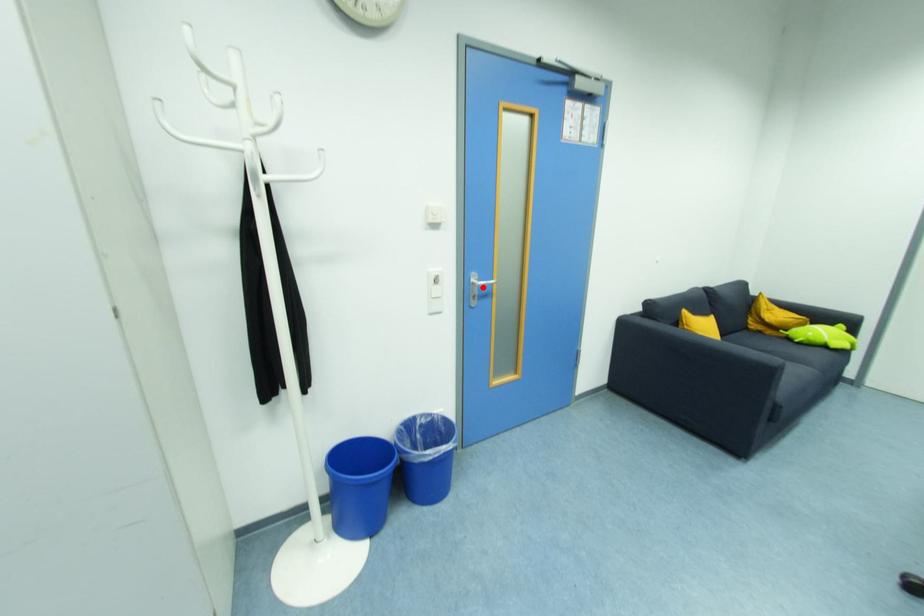
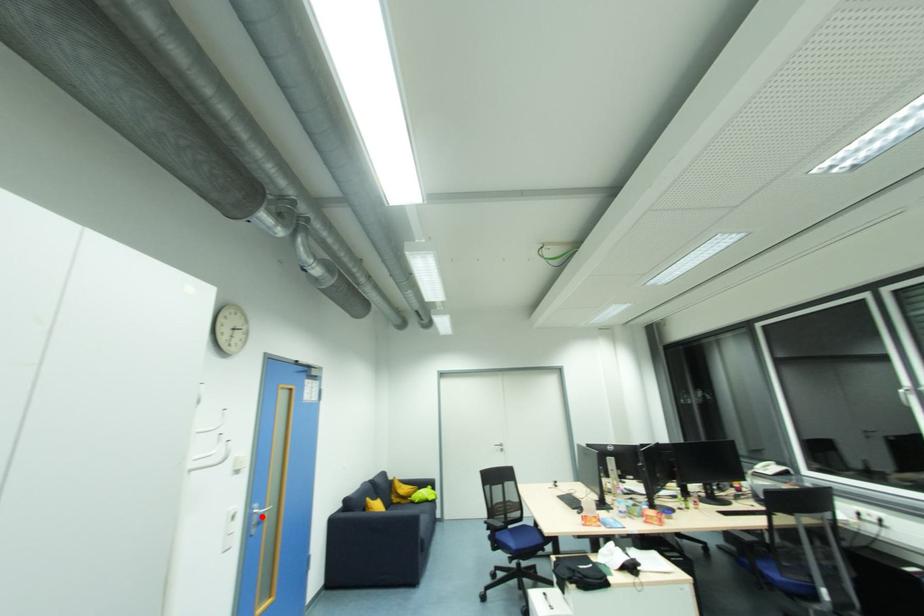
I am providing you with two images of the same scene from different viewpoints. A red point is marked on the first image and another point is marked on the second image. Do the highlighted points in image1 and image2 indicate the same real-world spot?

Yes